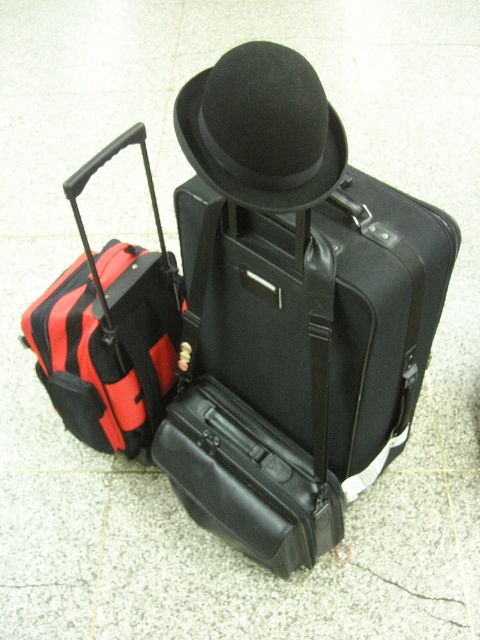
Question: In this image, where is black leather suitcase at center located relative to black felt fedora at center?

Choices:
 (A) above
 (B) below

Answer: (B)

Question: Which object is the farthest from the black matte suitcase at center?

Choices:
 (A) black felt fedora at center
 (B) red/black striped suitcase at left
 (C) black leather suitcase at center

Answer: (A)

Question: Is red/black striped suitcase at left in front of black felt fedora at center?

Choices:
 (A) yes
 (B) no

Answer: (B)

Question: Which object appears closest to the camera in this image?

Choices:
 (A) black felt fedora at center
 (B) black leather suitcase at center
 (C) black matte suitcase at center
 (D) red/black striped suitcase at left

Answer: (A)

Question: Which of the following is the farthest from the observer?

Choices:
 (A) (178, 490)
 (B) (147, 376)
 (C) (282, 388)
 (D) (263, 84)

Answer: (A)

Question: Does black leather suitcase at center appear on the right side of black felt fedora at center?

Choices:
 (A) no
 (B) yes

Answer: (A)